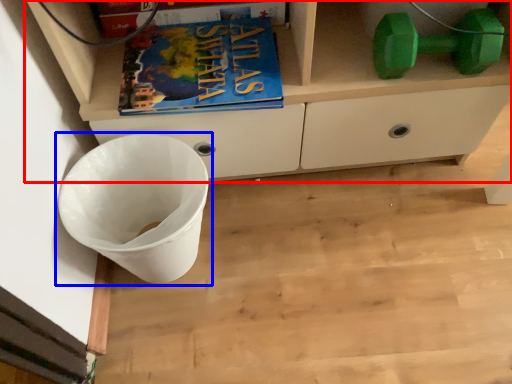
Question: Which object appears farthest to the camera in this image, cabinetry (highlighted by a red box) or waste container (highlighted by a blue box)?

Choices:
 (A) cabinetry
 (B) waste container

Answer: (B)